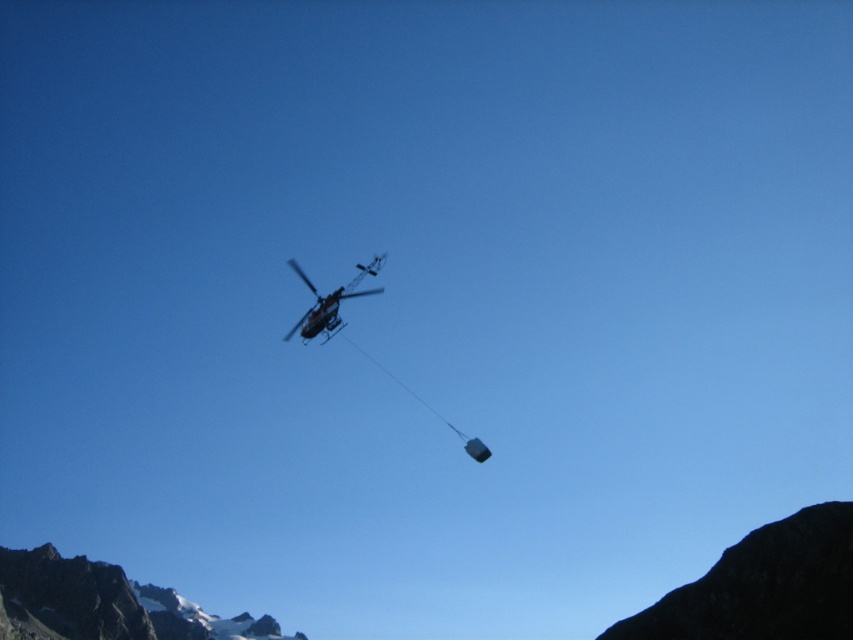
You are a pilot flying the metallic silver helicopter at center and need to land on the black rocky mountain at lower right. Can you safely land on the mountain? Explain why based on their sizes.

The black rocky mountain at lower right is shorter than the metallic silver helicopter at center. Since the mountain is shorter than the helicopter, there might not be enough space or a suitable landing area for the helicopter to land safely. The helicopter requires a landing zone that can accommodate its size and height, which the mountain may not provide.

You are a drone operator trying to capture a photo of the helicopter in the scene. The drone has a maximum flight range of 100 meters. You need to reach the point at coordinates point (807, 582) to get the best shot. Can your drone safely reach this point?

The distance of point (807, 582) from camera is 118.62 meters, which exceeds the drone maximum flight range of 100 meters. Therefore the drone cannot safely reach this point.

Based on the photo, you are a drone operator planning to fly a drone from the helicopter to the black rocky mountain at lower right. The point at coordinates (763,586) is on the black rocky mountain at lower right. Is this point on the mountain within the drone camera view from the helicopter?

The point at coordinates (763,586) is on the black rocky mountain at lower right, so yes, the drone camera can view this point from the helicopter as it is positioned on the mountain.